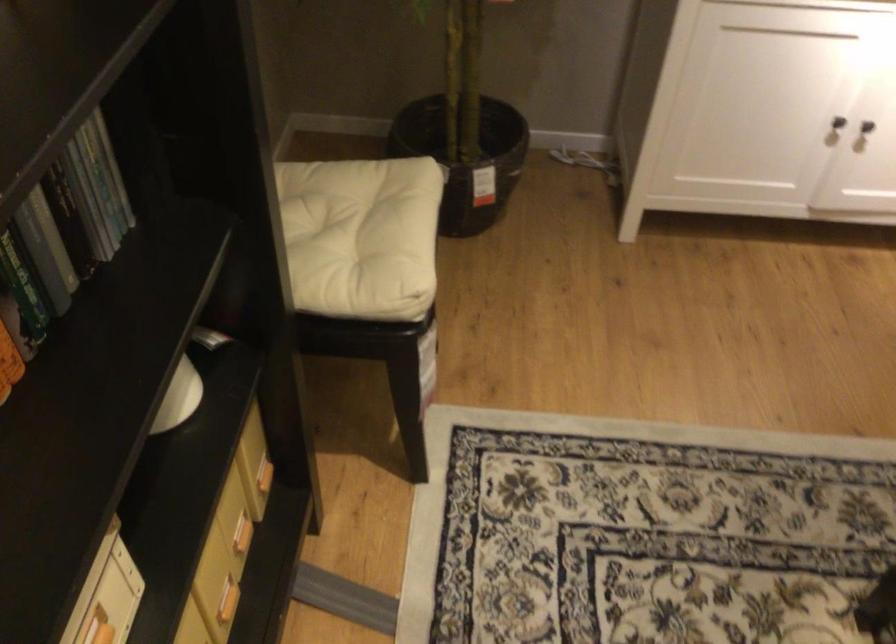
Where would you sit the chair sitting surface? Please return your answer as a coordinate pair (x, y).

(355, 234)